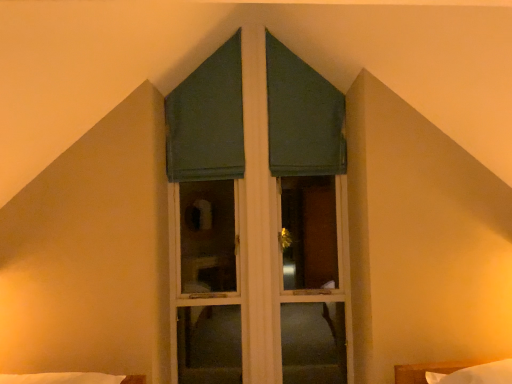
What do you see at coordinates (302, 117) in the screenshot?
I see `green fabric curtain at upper center, marked as the second curtain in a left-to-right arrangement` at bounding box center [302, 117].

How much space does green fabric curtain at center, positioned as the 2th curtain in right-to-left order, occupy vertically?

3.76 feet.

Find the location of a particular element. green fabric curtain at upper center, marked as the second curtain in a left-to-right arrangement is located at coordinates (302, 117).

Looking at this image, considering the positions of objects green matte window at center and green fabric curtain at center, marked as the first curtain in a left-to-right arrangement, in the image provided, who is in front, green matte window at center or green fabric curtain at center, marked as the first curtain in a left-to-right arrangement,?

green matte window at center.

Are green matte window at center and green fabric curtain at center, marked as the first curtain in a left-to-right arrangement, beside each other?

No, green matte window at center is not with green fabric curtain at center, marked as the first curtain in a left-to-right arrangement.

Which object is thinner, green matte window at center or green fabric curtain at center, marked as the first curtain in a left-to-right arrangement?

Thinner between the two is green fabric curtain at center, marked as the first curtain in a left-to-right arrangement.

From the picture: Is green matte window at center located outside green fabric curtain at center, marked as the first curtain in a left-to-right arrangement?

Indeed, green matte window at center is completely outside green fabric curtain at center, marked as the first curtain in a left-to-right arrangement.

Is white soft bed at lower right positioned far away from green matte window at center?

Absolutely, white soft bed at lower right is distant from green matte window at center.

Does white soft bed at lower right come in front of green matte window at center?

Yes, white soft bed at lower right is closer to the viewer.

From the image's perspective, between white soft bed at lower right and green matte window at center, who is located below?

white soft bed at lower right appears lower in the image.

Does green fabric curtain at center, marked as the first curtain in a left-to-right arrangement, have a greater width compared to green matte window at center?

In fact, green fabric curtain at center, marked as the first curtain in a left-to-right arrangement, might be narrower than green matte window at center.

Are green fabric curtain at center, marked as the first curtain in a left-to-right arrangement, and green matte window at center making contact?

No, green fabric curtain at center, marked as the first curtain in a left-to-right arrangement, is not making contact with green matte window at center.

Considering the positions of objects green fabric curtain at center, marked as the first curtain in a left-to-right arrangement, and green matte window at center in the image provided, who is behind, green fabric curtain at center, marked as the first curtain in a left-to-right arrangement, or green matte window at center?

green fabric curtain at center, marked as the first curtain in a left-to-right arrangement, is behind.

Is green matte window at center to the right of white soft bed at lower right from the viewer's perspective?

In fact, green matte window at center is to the left of white soft bed at lower right.

Is green matte window at center looking in the opposite direction of white soft bed at lower right?

green matte window at center does not have its back to white soft bed at lower right.

Which of these two, green matte window at center or white soft bed at lower right, is smaller?

Smaller between the two is white soft bed at lower right.

Is white soft bed at lower right wider or thinner than green fabric curtain at center, marked as the first curtain in a left-to-right arrangement?

Clearly, white soft bed at lower right has more width compared to green fabric curtain at center, marked as the first curtain in a left-to-right arrangement.

Is white soft bed at lower right far away from green fabric curtain at center, positioned as the 2th curtain in right-to-left order?

Yes, white soft bed at lower right and green fabric curtain at center, positioned as the 2th curtain in right-to-left order, are quite far apart.

Is white soft bed at lower right outside of green fabric curtain at center, marked as the first curtain in a left-to-right arrangement?

white soft bed at lower right lies outside green fabric curtain at center, marked as the first curtain in a left-to-right arrangement,'s area.

Is white soft bed at lower right at the left side of green fabric curtain at center, positioned as the 2th curtain in right-to-left order?

In fact, white soft bed at lower right is to the right of green fabric curtain at center, positioned as the 2th curtain in right-to-left order.

Can you confirm if white soft bed at lower right is bigger than green fabric curtain at upper center, marked as the second curtain in a left-to-right arrangement?

Yes.

In the scene shown: Can you tell me how much white soft bed at lower right and green fabric curtain at upper center, marked as the first curtain in a right-to-left arrangement, differ in facing direction?

The angle between the facing direction of white soft bed at lower right and the facing direction of green fabric curtain at upper center, marked as the first curtain in a right-to-left arrangement, is 142 degrees.

Between point (442, 373) and point (285, 148), which one is positioned behind?

Positioned behind is point (285, 148).

In terms of height, does white soft bed at lower right look taller or shorter compared to green fabric curtain at upper center, marked as the first curtain in a right-to-left arrangement?

In the image, white soft bed at lower right appears to be shorter than green fabric curtain at upper center, marked as the first curtain in a right-to-left arrangement.

How far apart are green fabric curtain at upper center, marked as the second curtain in a left-to-right arrangement, and green fabric curtain at center, marked as the first curtain in a left-to-right arrangement?

green fabric curtain at upper center, marked as the second curtain in a left-to-right arrangement, and green fabric curtain at center, marked as the first curtain in a left-to-right arrangement, are 18.37 inches apart.

Is green fabric curtain at upper center, marked as the first curtain in a right-to-left arrangement, to the left of green fabric curtain at center, marked as the first curtain in a left-to-right arrangement, from the viewer's perspective?

In fact, green fabric curtain at upper center, marked as the first curtain in a right-to-left arrangement, is to the right of green fabric curtain at center, marked as the first curtain in a left-to-right arrangement.

Would you say green fabric curtain at upper center, marked as the second curtain in a left-to-right arrangement, contains green fabric curtain at center, positioned as the 2th curtain in right-to-left order?

No, green fabric curtain at center, positioned as the 2th curtain in right-to-left order, is located outside of green fabric curtain at upper center, marked as the second curtain in a left-to-right arrangement.

The width and height of the screenshot is (512, 384). Find the location of `curtain on the left of green matte window at center`. curtain on the left of green matte window at center is located at coordinates (207, 120).

You are a GUI agent. You are given a task and a screenshot of the screen. Output one action in this format:
    pyautogui.click(x=<x>, y=<y>)
    Task: Click on the bed below the green matte window at center (from the image's perspective)
    
    Given the screenshot: What is the action you would take?
    pyautogui.click(x=456, y=372)

When comparing their distances from white soft bed at lower right, does green fabric curtain at center, positioned as the 2th curtain in right-to-left order, or green matte window at center seem further?

The object further to white soft bed at lower right is green fabric curtain at center, positioned as the 2th curtain in right-to-left order.

Looking at the image, which one is located closer to green matte window at center, white soft bed at lower right or green fabric curtain at center, marked as the first curtain in a left-to-right arrangement?

The object closer to green matte window at center is green fabric curtain at center, marked as the first curtain in a left-to-right arrangement.

Looking at the image, which one is located closer to white soft bed at lower right, green fabric curtain at upper center, marked as the second curtain in a left-to-right arrangement, or green matte window at center?

green matte window at center is closer to white soft bed at lower right.

Looking at the image, which one is located closer to green fabric curtain at center, positioned as the 2th curtain in right-to-left order, white soft bed at lower right or green fabric curtain at upper center, marked as the second curtain in a left-to-right arrangement?

Based on the image, green fabric curtain at upper center, marked as the second curtain in a left-to-right arrangement, appears to be nearer to green fabric curtain at center, positioned as the 2th curtain in right-to-left order.

From the picture: Which object lies further to the anchor point green fabric curtain at upper center, marked as the first curtain in a right-to-left arrangement, green matte window at center or white soft bed at lower right?

Based on the image, white soft bed at lower right appears to be further to green fabric curtain at upper center, marked as the first curtain in a right-to-left arrangement.

From the image, which object appears to be farther from green matte window at center, white soft bed at lower right or green fabric curtain at upper center, marked as the first curtain in a right-to-left arrangement?

Among the two, white soft bed at lower right is located further to green matte window at center.

Based on their spatial positions, is green fabric curtain at center, marked as the first curtain in a left-to-right arrangement, or green fabric curtain at upper center, marked as the first curtain in a right-to-left arrangement, closer to green matte window at center?

green fabric curtain at upper center, marked as the first curtain in a right-to-left arrangement, lies closer to green matte window at center than the other object.

Which object lies further to the anchor point green fabric curtain at center, marked as the first curtain in a left-to-right arrangement, white soft bed at lower right or green matte window at center?

white soft bed at lower right lies further to green fabric curtain at center, marked as the first curtain in a left-to-right arrangement, than the other object.

At what (x,y) coordinates should I click in order to perform the action: click on bay window between green fabric curtain at upper center, marked as the first curtain in a right-to-left arrangement, and white soft bed at lower right in the up-down direction. Please return your answer as a coordinate pair (x, y). Looking at the image, I should click on (257, 219).

Where is `curtain that lies between green fabric curtain at upper center, marked as the second curtain in a left-to-right arrangement, and white soft bed at lower right from top to bottom`? curtain that lies between green fabric curtain at upper center, marked as the second curtain in a left-to-right arrangement, and white soft bed at lower right from top to bottom is located at coordinates (207, 120).

Image resolution: width=512 pixels, height=384 pixels. What are the coordinates of `bay window between green fabric curtain at center, positioned as the 2th curtain in right-to-left order, and white soft bed at lower right, in the vertical direction` in the screenshot? It's located at (257, 219).

Where is `curtain between green fabric curtain at upper center, marked as the second curtain in a left-to-right arrangement, and green matte window at center vertically`? Image resolution: width=512 pixels, height=384 pixels. curtain between green fabric curtain at upper center, marked as the second curtain in a left-to-right arrangement, and green matte window at center vertically is located at coordinates (207, 120).